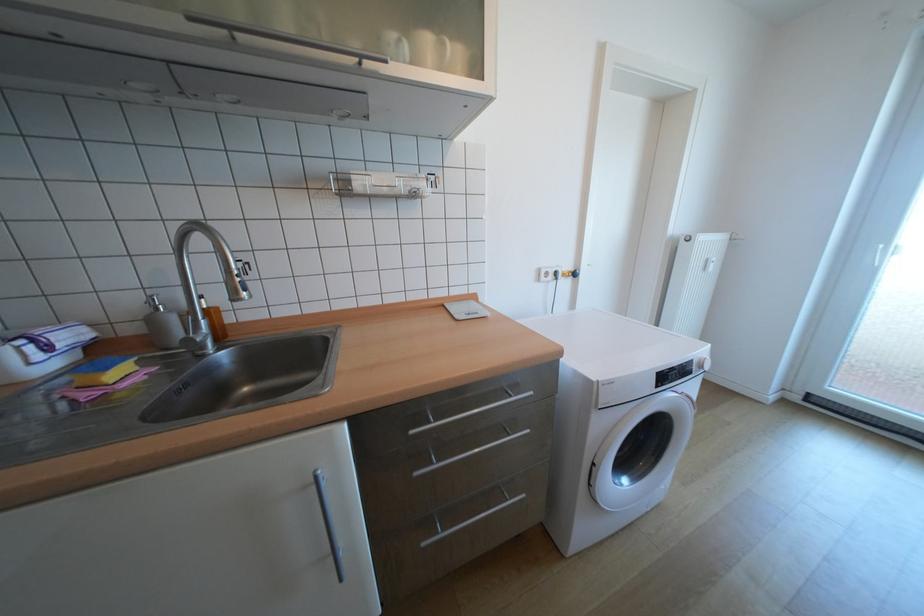
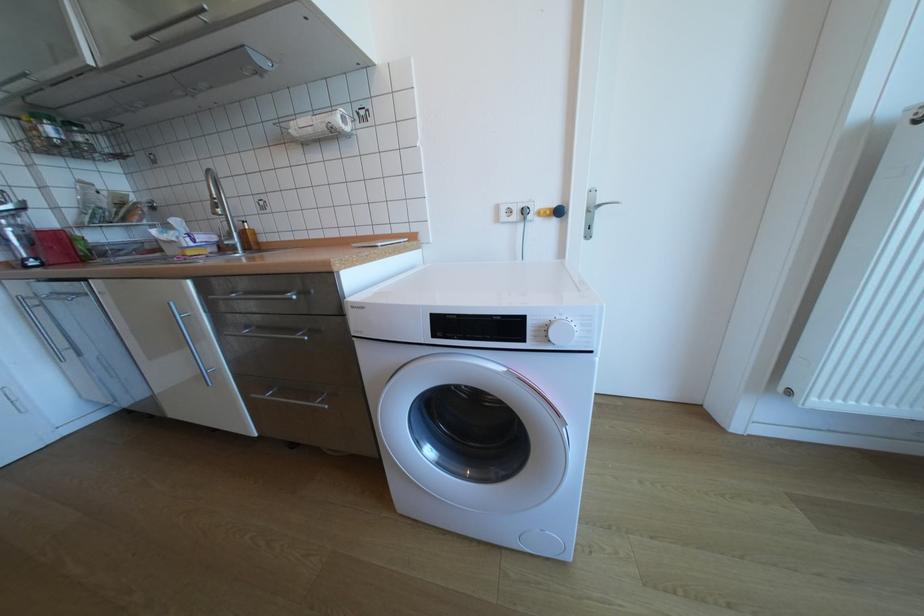
Locate, in the second image, the point that corresponds to point 88,354 in the first image.

(224, 249)